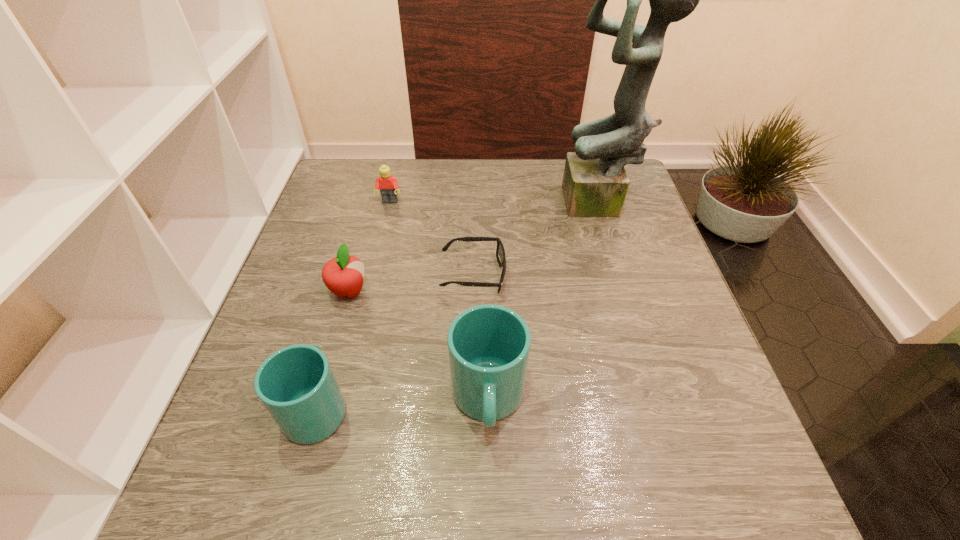
Identify the location of cup at the left edge. This screenshot has height=540, width=960. (296, 384).

You are a GUI agent. You are given a task and a screenshot of the screen. Output one action in this format:
    pyautogui.click(x=<x>, y=<y>)
    Task: Click on the apple situated at the left edge
    The image size is (960, 540).
    Given the screenshot: What is the action you would take?
    pyautogui.click(x=343, y=275)

At what (x,y) coordinates should I click in order to perform the action: click on object that is at the right edge. Please return your answer as a coordinate pair (x, y). Image resolution: width=960 pixels, height=540 pixels. Looking at the image, I should click on (595, 183).

Where is `object at the near left corner`? Image resolution: width=960 pixels, height=540 pixels. object at the near left corner is located at coordinates (296, 384).

Find the location of a particular element. The height and width of the screenshot is (540, 960). object that is at the far right corner is located at coordinates (595, 183).

In the image, there is a desktop. What are the coordinates of `vacant space at the far edge` in the screenshot? It's located at (423, 200).

Image resolution: width=960 pixels, height=540 pixels. I want to click on vacant space at the near edge, so click(396, 400).

Where is `vacant space at the right edge of the desktop`? This screenshot has width=960, height=540. vacant space at the right edge of the desktop is located at coordinates (617, 291).

Where is `vacant region at the far left corner of the desktop`? vacant region at the far left corner of the desktop is located at coordinates (331, 181).

Where is `vacant space at the near left corner of the desktop`? The image size is (960, 540). vacant space at the near left corner of the desktop is located at coordinates (238, 433).